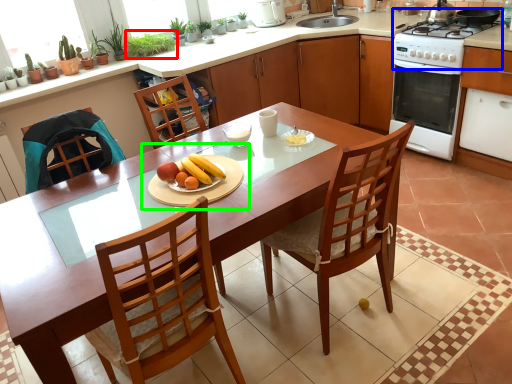
Question: Based on their relative distances, which object is nearer to plant (highlighted by a red box)? Choose from gas stove (highlighted by a blue box) and fruit dish (highlighted by a green box).

Choices:
 (A) gas stove
 (B) fruit dish

Answer: (B)